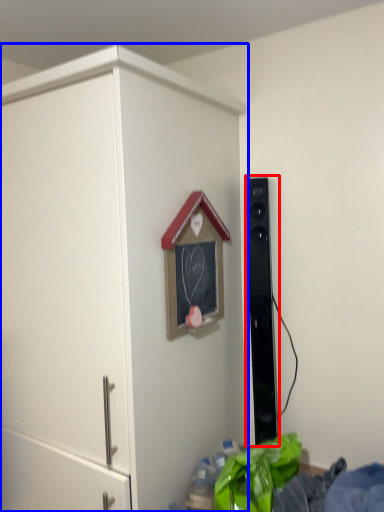
Question: Among these objects, which one is farthest to the camera, speaker (highlighted by a red box) or cupboard (highlighted by a blue box)?

Choices:
 (A) speaker
 (B) cupboard

Answer: (A)